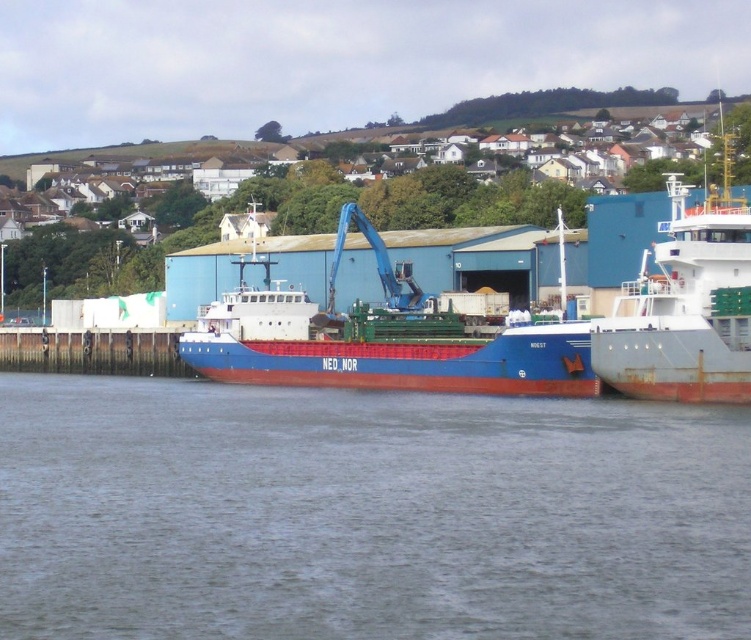
Which is behind, point (550, 524) or point (291, 365)?

Point (291, 365)

Which of these two, gray water at center or blue matte cargo ship at center, stands taller?

With more height is blue matte cargo ship at center.

Who is more distant from viewer, (602, 435) or (369, 333)?

The point (369, 333) is behind.

What are the coordinates of `gray water at center` in the screenshot? It's located at (365, 513).